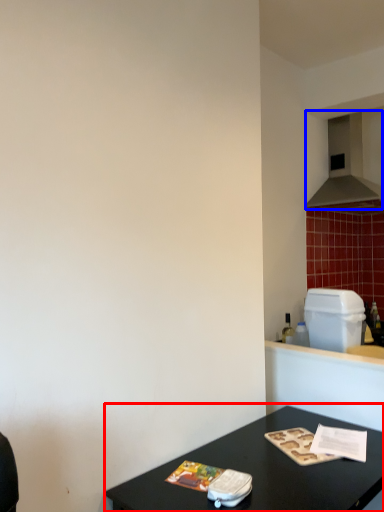
Question: Which point is further to the camera, table (highlighted by a red box) or exhaust hood (highlighted by a blue box)?

Choices:
 (A) table
 (B) exhaust hood

Answer: (B)